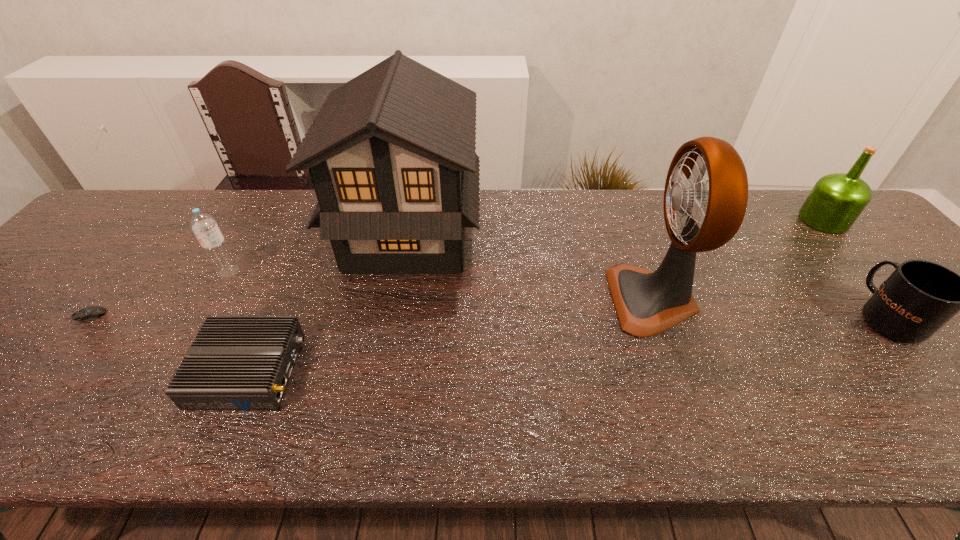
Image resolution: width=960 pixels, height=540 pixels. Identify the location of blank space at the far right corner. (787, 198).

Image resolution: width=960 pixels, height=540 pixels. In order to click on unoccupied position between the third object from right to left and the olive oil in this screenshot , I will do `click(738, 260)`.

Locate an element on the screen. empty space between the fourth tallest object and the mug is located at coordinates point(558,294).

At what (x,y) coordinates should I click in order to perform the action: click on free space that is in between the mug and the shortest object. Please return your answer as a coordinate pair (x, y). Image resolution: width=960 pixels, height=540 pixels. Looking at the image, I should click on (488, 316).

The width and height of the screenshot is (960, 540). I want to click on vacant space that's between the sixth tallest object and the dollhouse, so click(x=328, y=302).

This screenshot has width=960, height=540. What are the coordinates of `vacant space in between the olive oil and the fifth tallest object` in the screenshot? It's located at (855, 268).

You are a GUI agent. You are given a task and a screenshot of the screen. Output one action in this format:
    pyautogui.click(x=<x>, y=<y>)
    Task: Click on the free point between the mug and the third object from right to left
    
    Given the screenshot: What is the action you would take?
    pyautogui.click(x=770, y=308)

The width and height of the screenshot is (960, 540). What are the coordinates of `free space between the third object from right to left and the olive oil` in the screenshot? It's located at (738, 260).

Find the location of a particular element. unoccupied area between the dollhouse and the water bottle is located at coordinates (319, 253).

The image size is (960, 540). I want to click on vacant space in between the dollhouse and the second object from left to right, so click(x=319, y=253).